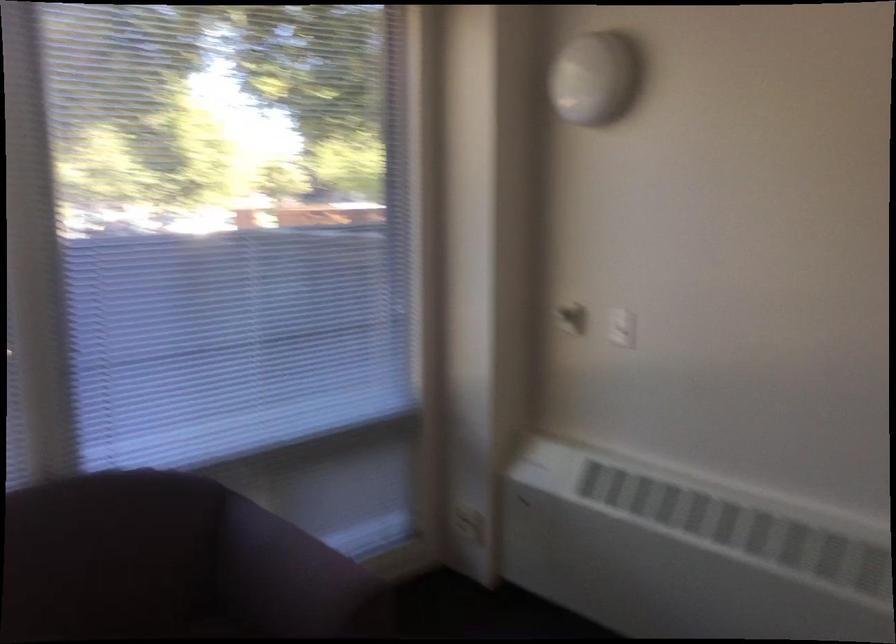
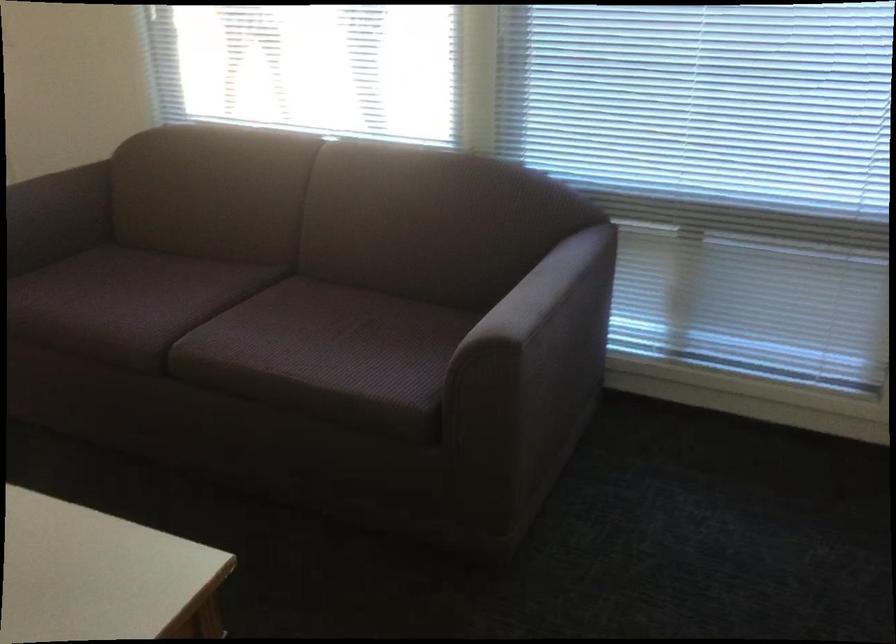
The point at (312, 554) is marked in the first image. Where is the corresponding point in the second image?

(545, 294)